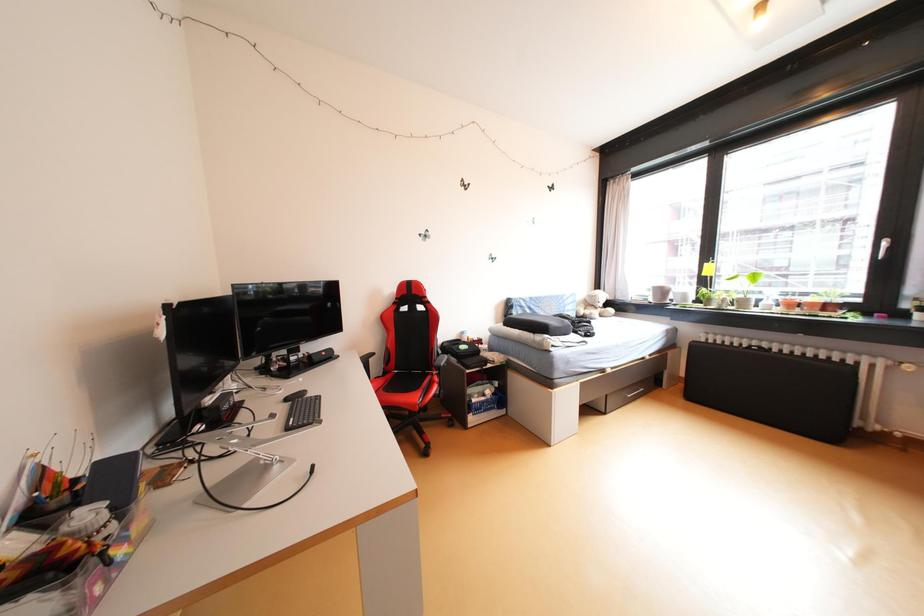
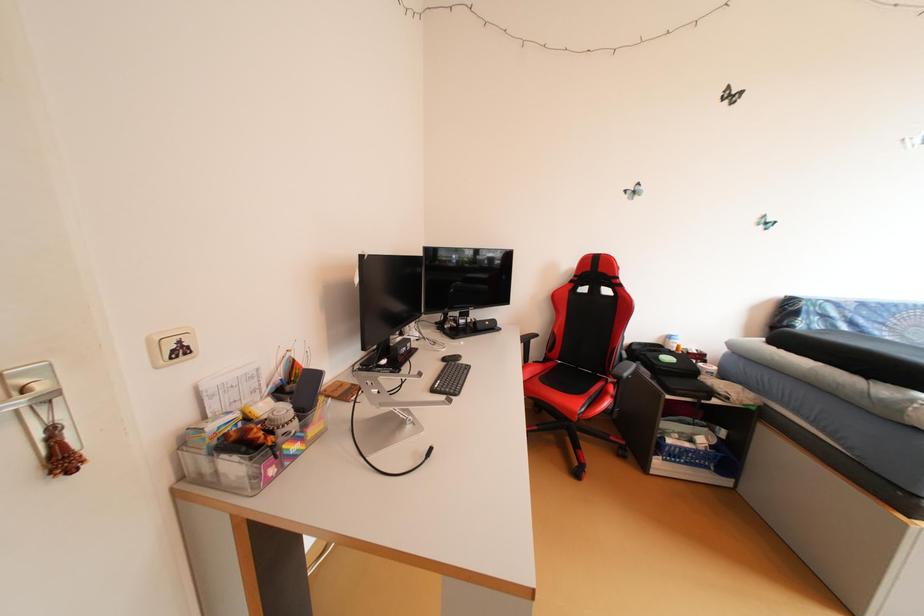
Question: Based on the continuous images, in which direction is the camera rotating? Reply with the corresponding letter.

Choices:
 (A) Left
 (B) Right
 (C) Up
 (D) Down

Answer: (A)